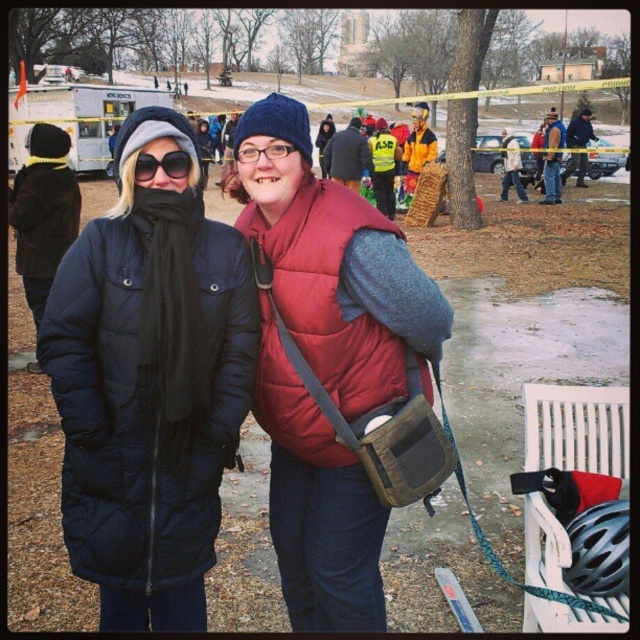
Where is `white plastic park bench at lower right`? This screenshot has width=640, height=640. white plastic park bench at lower right is located at coordinates (577, 428).

Which is above, white plastic park bench at lower right or clear plastic glasses at center?

clear plastic glasses at center

The width and height of the screenshot is (640, 640). Find the location of `white plastic park bench at lower right`. white plastic park bench at lower right is located at coordinates (577, 428).

Does white plastic park bench at lower right appear under black matte sunglasses at center?

Indeed, white plastic park bench at lower right is positioned under black matte sunglasses at center.

Which of these two, white plastic park bench at lower right or black matte sunglasses at center, stands taller?

white plastic park bench at lower right

Identify the location of white plastic park bench at lower right. This screenshot has height=640, width=640. (577, 428).

Where is `white plastic park bench at lower right`? This screenshot has width=640, height=640. white plastic park bench at lower right is located at coordinates (577, 428).

Describe the element at coordinates (417, 147) in the screenshot. Image resolution: width=640 pixels, height=640 pixels. I see `orange and yellow jacket at center` at that location.

Between orange and yellow jacket at center and clear plastic glasses at center, which one is positioned higher?

orange and yellow jacket at center is above.

Is point (428, 145) positioned behind point (289, 150)?

Yes, it is behind point (289, 150).

Locate an element on the screen. The height and width of the screenshot is (640, 640). orange and yellow jacket at center is located at coordinates (417, 147).